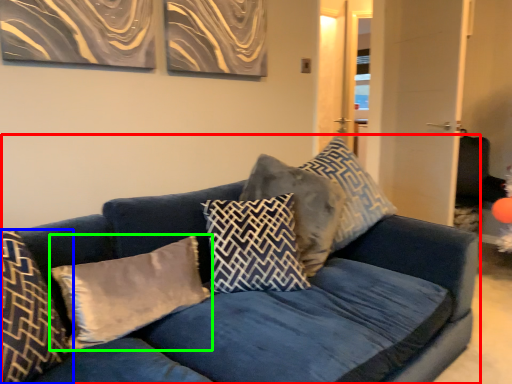
Question: Which object is positioned farthest from studio couch (highlighted by a red box)? Select from pillow (highlighted by a blue box) and pillow (highlighted by a green box).

Choices:
 (A) pillow
 (B) pillow

Answer: (A)